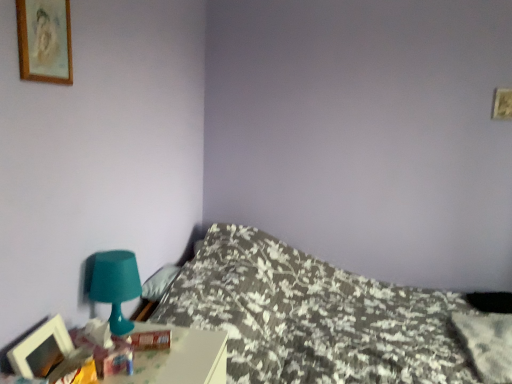
Image resolution: width=512 pixels, height=384 pixels. Find the location of `teal plastic table lamp at lower left`. teal plastic table lamp at lower left is located at coordinates (114, 284).

This screenshot has width=512, height=384. Describe the element at coordinates (114, 284) in the screenshot. I see `teal plastic table lamp at lower left` at that location.

Find the location of a particular element. Image resolution: width=512 pixels, height=384 pixels. fluffy white pillow at center, the second pillow viewed from the left is located at coordinates (487, 344).

Where is `wooden-framed painting at upper left, the 2th picture frame in the bottom-to-top sequence`? The height and width of the screenshot is (384, 512). wooden-framed painting at upper left, the 2th picture frame in the bottom-to-top sequence is located at coordinates (45, 40).

Find the location of a particular element. wooden picture frame at lower left, arranged as the 2th picture frame when viewed from the top is located at coordinates (41, 349).

Is wooden-framed painting at upper left, the 2th picture frame in the bottom-to-top sequence, at the back of teal plastic table lamp at lower left?

That's not correct — teal plastic table lamp at lower left is not looking away from wooden-framed painting at upper left, the 2th picture frame in the bottom-to-top sequence.

Considering the positions of objects teal plastic table lamp at lower left and wooden-framed painting at upper left, the first picture frame viewed from the top, in the image provided, who is more to the left, teal plastic table lamp at lower left or wooden-framed painting at upper left, the first picture frame viewed from the top,?

wooden-framed painting at upper left, the first picture frame viewed from the top, is more to the left.

In terms of size, does teal plastic table lamp at lower left appear bigger or smaller than wooden-framed painting at upper left, the first picture frame viewed from the top?

Clearly, teal plastic table lamp at lower left is larger in size than wooden-framed painting at upper left, the first picture frame viewed from the top.

From the image's perspective, which is below, wooden picture frame at lower left, arranged as the 1th picture frame when ordered from the bottom, or floral-patterned fabric bed at lower left?

floral-patterned fabric bed at lower left, from the image's perspective.

Between wooden picture frame at lower left, arranged as the 2th picture frame when viewed from the top, and floral-patterned fabric bed at lower left, which one has smaller size?

With smaller size is wooden picture frame at lower left, arranged as the 2th picture frame when viewed from the top.

Is wooden picture frame at lower left, arranged as the 2th picture frame when viewed from the top, not close to floral-patterned fabric bed at lower left?

Yes, wooden picture frame at lower left, arranged as the 2th picture frame when viewed from the top, is far from floral-patterned fabric bed at lower left.

Image resolution: width=512 pixels, height=384 pixels. I want to click on the 1st picture frame directly above the floral-patterned fabric bed at lower left (from a real-world perspective), so click(x=41, y=349).

From the image's perspective, who appears lower, teal plastic lamp at lower left or fluffy white pillow at center, the 1th pillow positioned from the bottom?

fluffy white pillow at center, the 1th pillow positioned from the bottom, appears lower in the image.

Does point (144, 378) lie in front of point (490, 381)?

Yes, it is.

Does teal plastic lamp at lower left have a greater height compared to fluffy white pillow at center, which appears as the first pillow when viewed from the right?

Incorrect, the height of teal plastic lamp at lower left is not larger of that of fluffy white pillow at center, which appears as the first pillow when viewed from the right.

Is teal plastic lamp at lower left touching fluffy white pillow at center, the second pillow viewed from the left?

No, teal plastic lamp at lower left is not touching fluffy white pillow at center, the second pillow viewed from the left.

Between fluffy white pillow at upper left, which is counted as the second pillow, starting from the bottom, and floral-patterned fabric bed at lower left, which one has larger size?

floral-patterned fabric bed at lower left is bigger.

Which is behind, point (170, 275) or point (385, 303)?

Positioned behind is point (385, 303).

Is fluffy white pillow at upper left, the second pillow in the right-to-left sequence, further to camera compared to floral-patterned fabric bed at lower left?

Yes, the depth of fluffy white pillow at upper left, the second pillow in the right-to-left sequence, is greater than that of floral-patterned fabric bed at lower left.

Does fluffy white pillow at upper left, positioned as the 1th pillow in top-to-bottom order, have a greater height compared to floral-patterned fabric bed at lower left?

Incorrect, the height of fluffy white pillow at upper left, positioned as the 1th pillow in top-to-bottom order, is not larger of that of floral-patterned fabric bed at lower left.

Is point (157, 290) farther from camera compared to point (116, 309)?

Yes, point (157, 290) is behind point (116, 309).

Which is more to the left, fluffy white pillow at upper left, which is counted as the second pillow, starting from the bottom, or teal plastic table lamp at lower left?

Positioned to the left is teal plastic table lamp at lower left.

Is the position of fluffy white pillow at upper left, which is counted as the second pillow, starting from the bottom, more distant than that of teal plastic table lamp at lower left?

That is True.

Considering the sizes of objects fluffy white pillow at upper left, positioned as the 1th pillow in top-to-bottom order, and teal plastic table lamp at lower left in the image provided, who is wider, fluffy white pillow at upper left, positioned as the 1th pillow in top-to-bottom order, or teal plastic table lamp at lower left?

teal plastic table lamp at lower left.

Considering the points (65, 64) and (215, 370), which point is behind, point (65, 64) or point (215, 370)?

Point (215, 370)

Consider the image. Considering their positions, is wooden-framed painting at upper left, the 2th picture frame in the bottom-to-top sequence, located in front of or behind teal plastic lamp at lower left?

In the image, wooden-framed painting at upper left, the 2th picture frame in the bottom-to-top sequence, appears in front of teal plastic lamp at lower left.

Find the location of a particular element. Image resolution: width=512 pixels, height=384 pixels. table lamp above the fluffy white pillow at center, the 1th pillow positioned from the bottom (from a real-world perspective) is located at coordinates (114, 284).

Looking at this image, from the image's perspective, would you say fluffy white pillow at center, the second pillow viewed from the left, is shown under teal plastic table lamp at lower left?

Correct, fluffy white pillow at center, the second pillow viewed from the left, appears lower than teal plastic table lamp at lower left in the image.

Which is behind, point (478, 353) or point (96, 264)?

The point (478, 353) is behind.

Is fluffy white pillow at center, the second pillow positioned from the top, next to teal plastic table lamp at lower left and touching it?

fluffy white pillow at center, the second pillow positioned from the top, and teal plastic table lamp at lower left are not in contact.

I want to click on picture frame that is above the teal plastic table lamp at lower left (from a real-world perspective), so click(x=45, y=40).

Which picture frame is the 1st one when counting from the front of the floral-patterned fabric bed at lower left? Please provide its 2D coordinates.

[(41, 349)]

Based on their spatial positions, is wooden picture frame at lower left, arranged as the 2th picture frame when viewed from the top, or wooden-framed painting at upper left, the first picture frame viewed from the top, further from fluffy white pillow at center, the 1th pillow positioned from the bottom?

Based on the image, wooden-framed painting at upper left, the first picture frame viewed from the top, appears to be further to fluffy white pillow at center, the 1th pillow positioned from the bottom.

Which object lies further to the anchor point wooden-framed painting at upper left, the first picture frame viewed from the top, fluffy white pillow at upper left, the second pillow in the right-to-left sequence, or wooden picture frame at lower left, arranged as the 1th picture frame when ordered from the bottom?

Based on the image, fluffy white pillow at upper left, the second pillow in the right-to-left sequence, appears to be further to wooden-framed painting at upper left, the first picture frame viewed from the top.

Based on their spatial positions, is teal plastic lamp at lower left or fluffy white pillow at center, the second pillow viewed from the left, closer to wooden picture frame at lower left, arranged as the 2th picture frame when viewed from the top?

teal plastic lamp at lower left lies closer to wooden picture frame at lower left, arranged as the 2th picture frame when viewed from the top, than the other object.

Considering their positions, is teal plastic lamp at lower left positioned further to teal plastic table lamp at lower left than fluffy white pillow at center, the second pillow positioned from the top?

The object further to teal plastic table lamp at lower left is fluffy white pillow at center, the second pillow positioned from the top.

Based on their spatial positions, is fluffy white pillow at upper left, marked as the first pillow in a left-to-right arrangement, or teal plastic lamp at lower left further from floral-patterned fabric bed at lower left?

Among the two, teal plastic lamp at lower left is located further to floral-patterned fabric bed at lower left.

From the image, which object appears to be nearer to teal plastic table lamp at lower left, wooden-framed painting at upper left, the first picture frame viewed from the top, or fluffy white pillow at center, the 1th pillow positioned from the bottom?

The object closer to teal plastic table lamp at lower left is wooden-framed painting at upper left, the first picture frame viewed from the top.

Looking at the image, which one is located closer to fluffy white pillow at upper left, which is counted as the second pillow, starting from the bottom, wooden picture frame at lower left, arranged as the 1th picture frame when ordered from the bottom, or teal plastic lamp at lower left?

The object closer to fluffy white pillow at upper left, which is counted as the second pillow, starting from the bottom, is teal plastic lamp at lower left.

Estimate the real-world distances between objects in this image. Which object is further from floral-patterned fabric bed at lower left, teal plastic table lamp at lower left or wooden picture frame at lower left, arranged as the 1th picture frame when ordered from the bottom?

wooden picture frame at lower left, arranged as the 1th picture frame when ordered from the bottom, is further to floral-patterned fabric bed at lower left.

The image size is (512, 384). What are the coordinates of `nightstand between wooden picture frame at lower left, arranged as the 1th picture frame when ordered from the bottom, and fluffy white pillow at center, which appears as the first pillow when viewed from the right` in the screenshot? It's located at (180, 359).

You are a GUI agent. You are given a task and a screenshot of the screen. Output one action in this format:
    pyautogui.click(x=<x>, y=<y>)
    Task: Click on the nightstand between wooden-framed painting at upper left, the first picture frame viewed from the top, and fluffy white pillow at center, the second pillow viewed from the left, from left to right
    
    Given the screenshot: What is the action you would take?
    pyautogui.click(x=180, y=359)

The height and width of the screenshot is (384, 512). I want to click on pillow between wooden-framed painting at upper left, the first picture frame viewed from the top, and wooden picture frame at lower left, arranged as the 2th picture frame when viewed from the top, in the up-down direction, so click(x=159, y=282).

Locate an element on the screen. This screenshot has width=512, height=384. picture frame located between wooden picture frame at lower left, arranged as the 2th picture frame when viewed from the top, and fluffy white pillow at center, the second pillow viewed from the left, in the left-right direction is located at coordinates (45, 40).